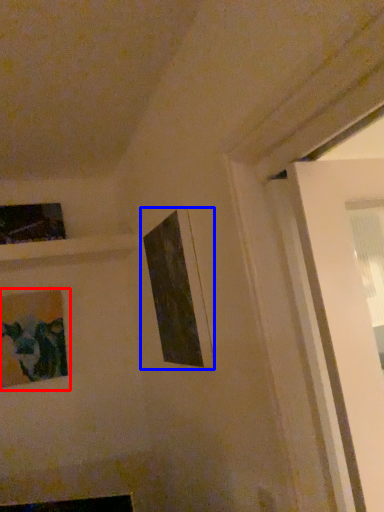
Question: Which object appears farthest to the camera in this image, picture frame (highlighted by a red box) or picture frame (highlighted by a blue box)?

Choices:
 (A) picture frame
 (B) picture frame

Answer: (A)